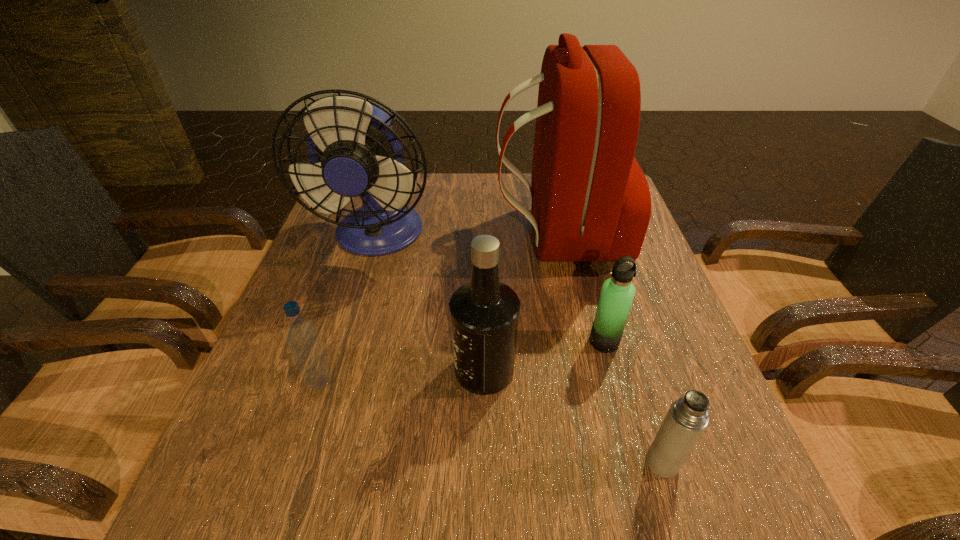
Find the location of `vacant area located in front of the fan where the airflow is directed`. vacant area located in front of the fan where the airflow is directed is located at coordinates (336, 382).

This screenshot has height=540, width=960. I want to click on vacant space located on the front label of the liquor, so click(402, 369).

Identify the location of free point located 0.130m on the front label of the liquor. (387, 369).

Identify the location of vacant space located 0.120m on the front label of the liquor. (392, 369).

The width and height of the screenshot is (960, 540). Find the location of `blank area located on the left of the farther thermos bottle`. blank area located on the left of the farther thermos bottle is located at coordinates (440, 341).

In order to click on vacant region located on the front of the water bottle in this screenshot , I will do `click(307, 424)`.

Image resolution: width=960 pixels, height=540 pixels. What are the coordinates of `free location located 0.150m on the back of the nearer thermos bottle` in the screenshot? It's located at (635, 374).

Identify the location of backpack that is at the far edge. (590, 201).

The height and width of the screenshot is (540, 960). Find the location of `fan that is at the far edge`. fan that is at the far edge is located at coordinates (354, 151).

Find the location of a particular element. The image size is (960, 540). fan present at the left edge is located at coordinates (354, 151).